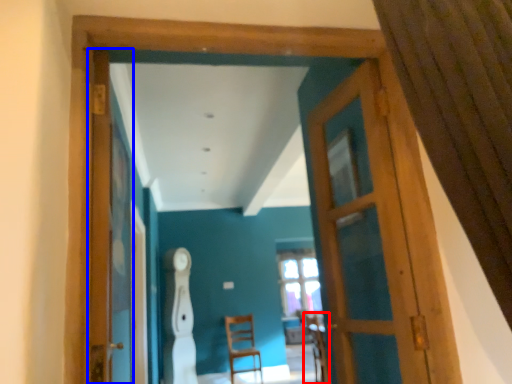
Question: Among these objects, which one is nearest to the camera, armchair (highlighted by a red box) or screen door (highlighted by a blue box)?

Choices:
 (A) armchair
 (B) screen door

Answer: (B)